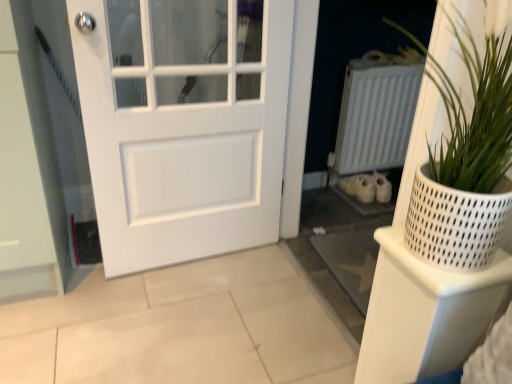
Identify the location of vacant space in white matte door at center (from a real-world perspective). The width and height of the screenshot is (512, 384). (197, 255).